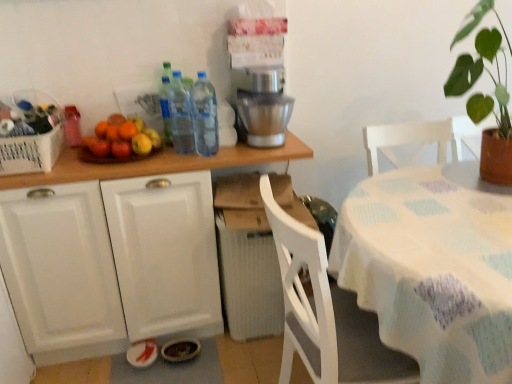
The image size is (512, 384). Find the location of `vacant area that is situated to the right of transparent plastic bottle at center, the 1th bottle viewed from the right`. vacant area that is situated to the right of transparent plastic bottle at center, the 1th bottle viewed from the right is located at coordinates (249, 150).